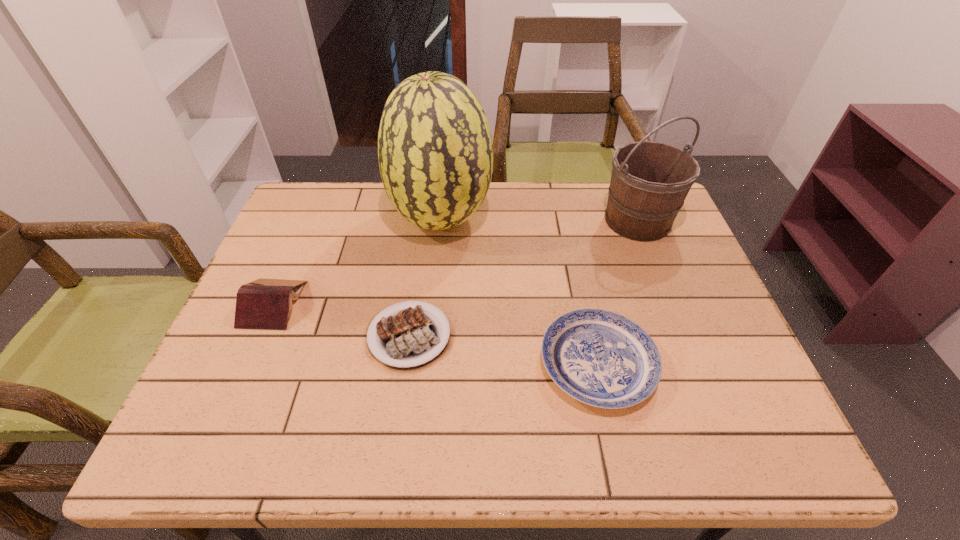
Locate an element on the screen. watermelon is located at coordinates (435, 153).

Identify the location of bucket. (649, 182).

Locate an element on the screen. the leftmost object is located at coordinates (264, 303).

I want to click on the third tallest object, so pyautogui.click(x=264, y=303).

You are a GUI agent. You are given a task and a screenshot of the screen. Output one action in this format:
    pyautogui.click(x=<x>, y=<y>)
    Task: Click on the taller plate
    
    Given the screenshot: What is the action you would take?
    pyautogui.click(x=600, y=358)

Find the location of `the fourth tallest object`. the fourth tallest object is located at coordinates (600, 358).

Locate an element on the screen. Image resolution: width=960 pixels, height=540 pixels. the shortest object is located at coordinates (406, 337).

Locate an element on the screen. The width and height of the screenshot is (960, 540). the left plate is located at coordinates (406, 337).

The width and height of the screenshot is (960, 540). I want to click on vacant space located on the front of the tallest object, so click(433, 300).

This screenshot has height=540, width=960. I want to click on free space located on the front of the fourth shortest object, so click(691, 357).